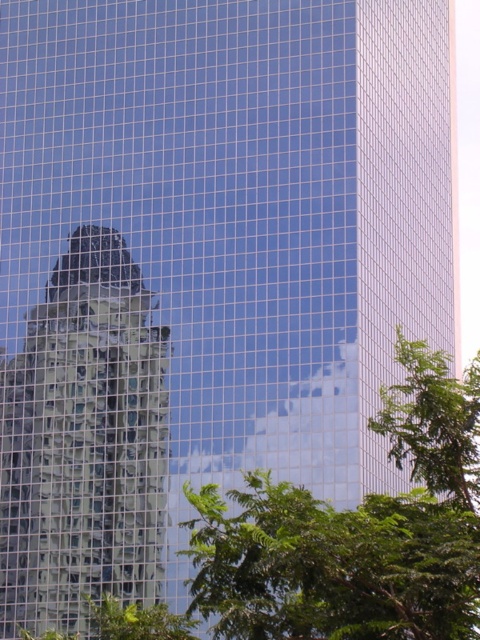
In the scene shown: Between reflective glass building at center and green leafy tree at center, which one appears on the right side from the viewer's perspective?

From the viewer's perspective, green leafy tree at center appears more on the right side.

The width and height of the screenshot is (480, 640). What do you see at coordinates (84, 444) in the screenshot? I see `reflective glass building at center` at bounding box center [84, 444].

Where is `reflective glass building at center`? reflective glass building at center is located at coordinates (84, 444).